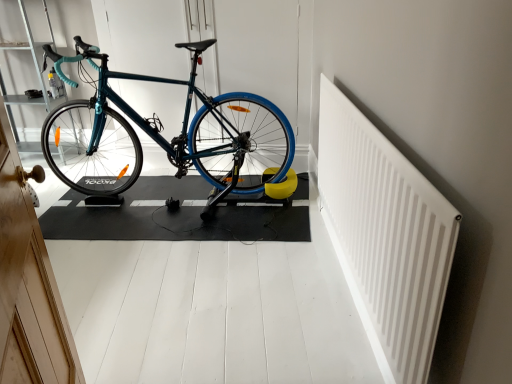
Describe the element at coordinates (163, 137) in the screenshot. I see `teal glossy bicycle at center` at that location.

The height and width of the screenshot is (384, 512). What do you see at coordinates (385, 236) in the screenshot?
I see `white plastic radiator at upper right` at bounding box center [385, 236].

Image resolution: width=512 pixels, height=384 pixels. I want to click on teal glossy bicycle at center, so click(x=163, y=137).

Can teal glossy bicycle at center be found inside white plastic radiator at upper right?

Definitely not — teal glossy bicycle at center is not inside white plastic radiator at upper right.

From the image's perspective, who appears lower, white plastic radiator at upper right or teal glossy bicycle at center?

From the image's view, white plastic radiator at upper right is below.

From a real-world perspective, does white plastic radiator at upper right sit lower than teal glossy bicycle at center?

Correct, in the physical world, white plastic radiator at upper right is lower than teal glossy bicycle at center.

Does point (372, 140) come farther from viewer compared to point (103, 79)?

No, (372, 140) is closer to viewer.

Is teal glossy bicycle at center turned away from teal matte bicycle handlebar at upper left?

No.

Considering the relative sizes of teal glossy bicycle at center and teal matte bicycle handlebar at upper left in the image provided, is teal glossy bicycle at center bigger than teal matte bicycle handlebar at upper left?

Correct, teal glossy bicycle at center is larger in size than teal matte bicycle handlebar at upper left.

How different are the orientations of teal glossy bicycle at center and teal matte bicycle handlebar at upper left in degrees?

The angle between the facing direction of teal glossy bicycle at center and the facing direction of teal matte bicycle handlebar at upper left is 88.4 degrees.

Where is `bicycle that appears below the teal matte bicycle handlebar at upper left (from the image's perspective)`? The height and width of the screenshot is (384, 512). bicycle that appears below the teal matte bicycle handlebar at upper left (from the image's perspective) is located at coordinates (163, 137).

Considering the relative sizes of teal glossy bicycle at center and white plastic radiator at upper right in the image provided, is teal glossy bicycle at center bigger than white plastic radiator at upper right?

Yes.

Is teal glossy bicycle at center positioned beyond the bounds of white plastic radiator at upper right?

Yes, teal glossy bicycle at center is located beyond the bounds of white plastic radiator at upper right.

Would you say teal glossy bicycle at center is to the left or to the right of white plastic radiator at upper right in the picture?

Clearly, teal glossy bicycle at center is on the left of white plastic radiator at upper right in the image.

From the image's perspective, which one is positioned lower, white plastic radiator at upper right or teal matte bicycle handlebar at upper left?

white plastic radiator at upper right is shown below in the image.

In the image, is white plastic radiator at upper right positioned in front of or behind teal matte bicycle handlebar at upper left?

white plastic radiator at upper right is positioned closer to the viewer than teal matte bicycle handlebar at upper left.

At what (x,y) coordinates should I click in order to perform the action: click on shelf behind the white plastic radiator at upper right. Please return your answer as a coordinate pair (x, y). This screenshot has height=384, width=512. Looking at the image, I should click on (37, 59).

Could you measure the distance between white plastic radiator at upper right and teal matte bicycle handlebar at upper left?

The distance of white plastic radiator at upper right from teal matte bicycle handlebar at upper left is 2.70 meters.

Which of these two, teal matte bicycle handlebar at upper left or teal glossy bicycle at center, is thinner?

Thinner between the two is teal matte bicycle handlebar at upper left.

Measure the distance from teal matte bicycle handlebar at upper left to teal glossy bicycle at center.

A distance of 82.62 centimeters exists between teal matte bicycle handlebar at upper left and teal glossy bicycle at center.

Considering the relative positions of teal matte bicycle handlebar at upper left and teal glossy bicycle at center in the image provided, is teal matte bicycle handlebar at upper left to the left of teal glossy bicycle at center from the viewer's perspective?

Yes, teal matte bicycle handlebar at upper left is to the left of teal glossy bicycle at center.

Can you tell me how much teal matte bicycle handlebar at upper left and teal glossy bicycle at center differ in facing direction?

88.4 degrees.

Which object is positioned more to the right, teal matte bicycle handlebar at upper left or white plastic radiator at upper right?

Positioned to the right is white plastic radiator at upper right.

Considering the relative sizes of teal matte bicycle handlebar at upper left and white plastic radiator at upper right in the image provided, is teal matte bicycle handlebar at upper left bigger than white plastic radiator at upper right?

Yes, teal matte bicycle handlebar at upper left is bigger than white plastic radiator at upper right.

From a real-world perspective, is teal matte bicycle handlebar at upper left positioned over white plastic radiator at upper right based on gravity?

Correct, in the physical world, teal matte bicycle handlebar at upper left is higher than white plastic radiator at upper right.

Who is more distant, teal matte bicycle handlebar at upper left or white plastic radiator at upper right?

teal matte bicycle handlebar at upper left is further from the camera.

The image size is (512, 384). I want to click on bicycle behind the white plastic radiator at upper right, so click(163, 137).

In the image, there is a teal matte bicycle handlebar at upper left. Identify the location of bicycle below it (from a real-world perspective). (163, 137).

Based on their spatial positions, is teal matte bicycle handlebar at upper left or white plastic radiator at upper right further from teal glossy bicycle at center?

white plastic radiator at upper right lies further to teal glossy bicycle at center than the other object.

When comparing their distances from white plastic radiator at upper right, does teal glossy bicycle at center or teal matte bicycle handlebar at upper left seem closer?

teal glossy bicycle at center is positioned closer to the anchor white plastic radiator at upper right.

From the image, which object appears to be nearer to teal glossy bicycle at center, white plastic radiator at upper right or teal matte bicycle handlebar at upper left?

The object closer to teal glossy bicycle at center is teal matte bicycle handlebar at upper left.

When comparing their distances from teal matte bicycle handlebar at upper left, does teal glossy bicycle at center or white plastic radiator at upper right seem closer?

teal glossy bicycle at center is closer to teal matte bicycle handlebar at upper left.

Looking at the image, which one is located closer to white plastic radiator at upper right, teal matte bicycle handlebar at upper left or teal glossy bicycle at center?

teal glossy bicycle at center lies closer to white plastic radiator at upper right than the other object.

Estimate the real-world distances between objects in this image. Which object is closer to teal matte bicycle handlebar at upper left, white plastic radiator at upper right or teal glossy bicycle at center?

teal glossy bicycle at center is closer to teal matte bicycle handlebar at upper left.

Locate an element on the screen. bicycle located between teal matte bicycle handlebar at upper left and white plastic radiator at upper right in the left-right direction is located at coordinates (163, 137).